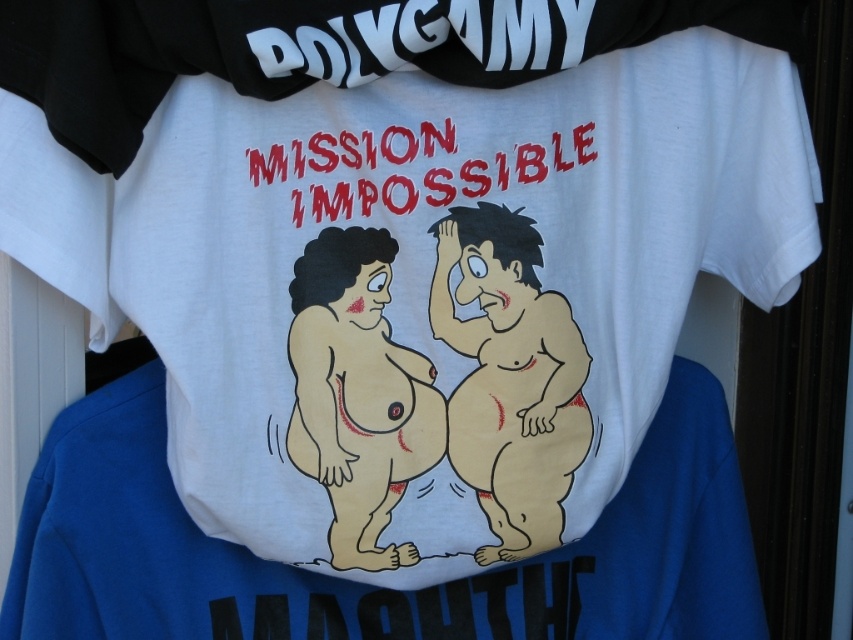
In the scene shown: Is beige matte/soft cartoon man at center in front of brown textured body at center?

No, beige matte/soft cartoon man at center is further to the viewer.

Measure the distance between beige matte/soft cartoon man at center and camera.

A distance of 1.31 meters exists between beige matte/soft cartoon man at center and camera.

The image size is (853, 640). What do you see at coordinates (509, 378) in the screenshot? I see `beige matte/soft cartoon man at center` at bounding box center [509, 378].

Identify the location of beige matte/soft cartoon man at center. The image size is (853, 640). (509, 378).

Can you confirm if matte white t-shirt at center is positioned below brown textured body at center?

Yes, matte white t-shirt at center is below brown textured body at center.

The height and width of the screenshot is (640, 853). I want to click on matte white t-shirt at center, so click(x=366, y=584).

Image resolution: width=853 pixels, height=640 pixels. In order to click on matte white t-shirt at center in this screenshot , I will do `click(366, 584)`.

Between matte white t-shirt at center and beige matte/soft cartoon man at center, which one appears on the left side from the viewer's perspective?

matte white t-shirt at center is more to the left.

Between point (757, 632) and point (540, 358), which one is positioned in front?

Point (540, 358) is in front.

What are the coordinates of `matte white t-shirt at center` in the screenshot? It's located at (366, 584).